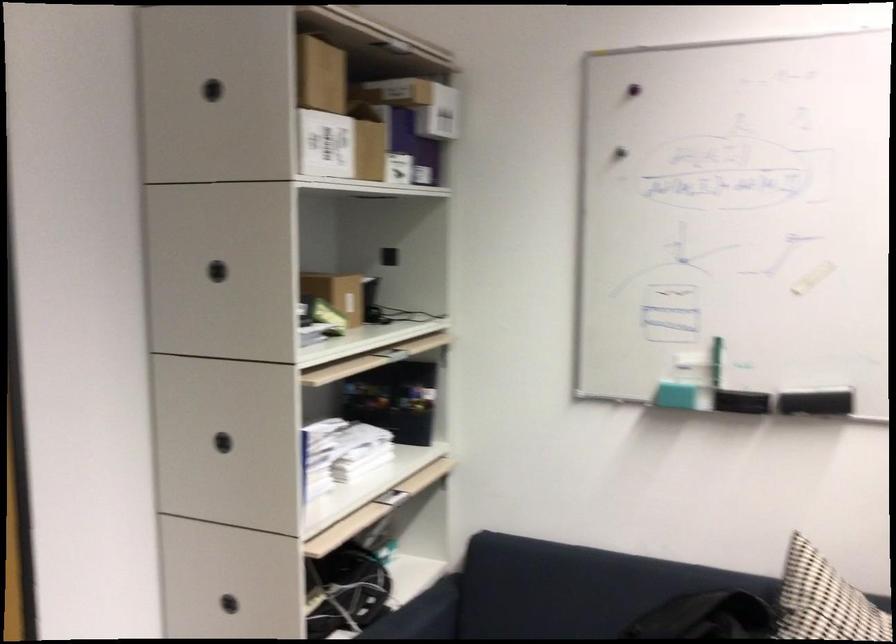
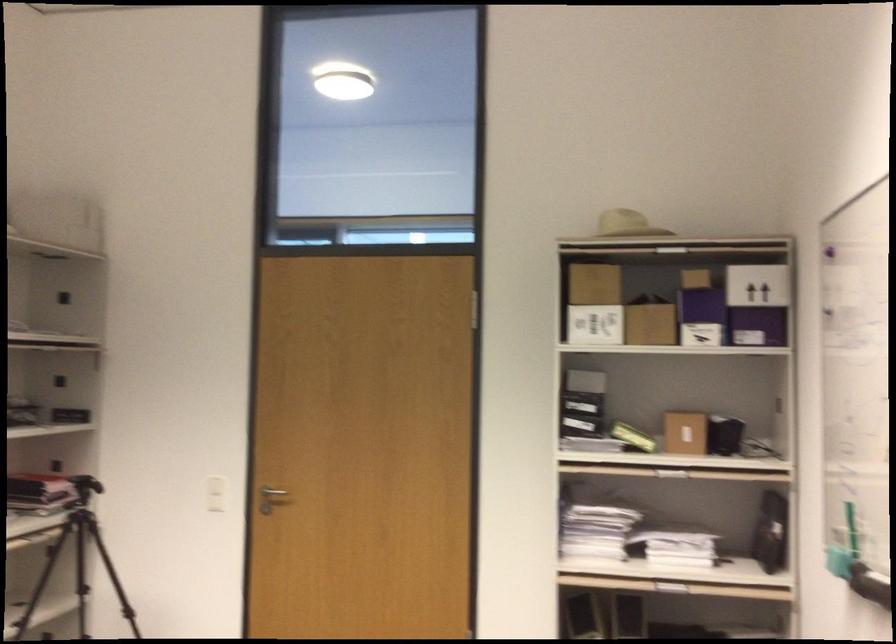
Where in the second image is the point corresponding to (x=300, y=80) from the first image?

(592, 283)